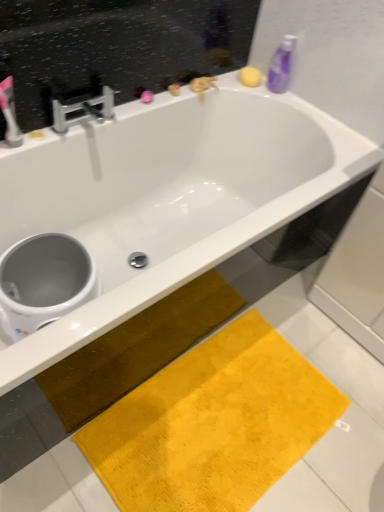
Image resolution: width=384 pixels, height=512 pixels. I want to click on free region under yellow plush bath mat at lower center (from a real-world perspective), so click(230, 417).